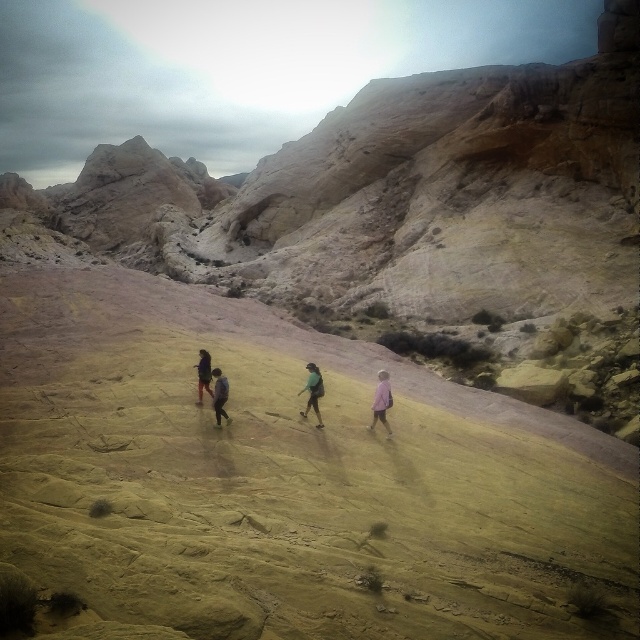
Question: Is pink fabric at center above dark blue fabric jacket at center?

Choices:
 (A) yes
 (B) no

Answer: (B)

Question: Which point is farther to the camera?

Choices:
 (A) (205, 358)
 (B) (317, 388)
 (C) (385, 406)

Answer: (A)

Question: Which object is positioned farthest from the pink fabric at center?

Choices:
 (A) dark blue fabric jacket at center
 (B) green fabric jacket at center
 (C) dark gray fabric jacket at center

Answer: (A)

Question: Can you confirm if dark gray fabric jacket at center is smaller than dark blue fabric jacket at center?

Choices:
 (A) no
 (B) yes

Answer: (B)

Question: Which point appears farthest from the camera in this image?

Choices:
 (A) (310, 378)
 (B) (385, 400)
 (C) (204, 349)
 (D) (212, 403)

Answer: (C)

Question: Where is pink fabric at center located in relation to dark blue fabric jacket at center in the image?

Choices:
 (A) left
 (B) right

Answer: (B)